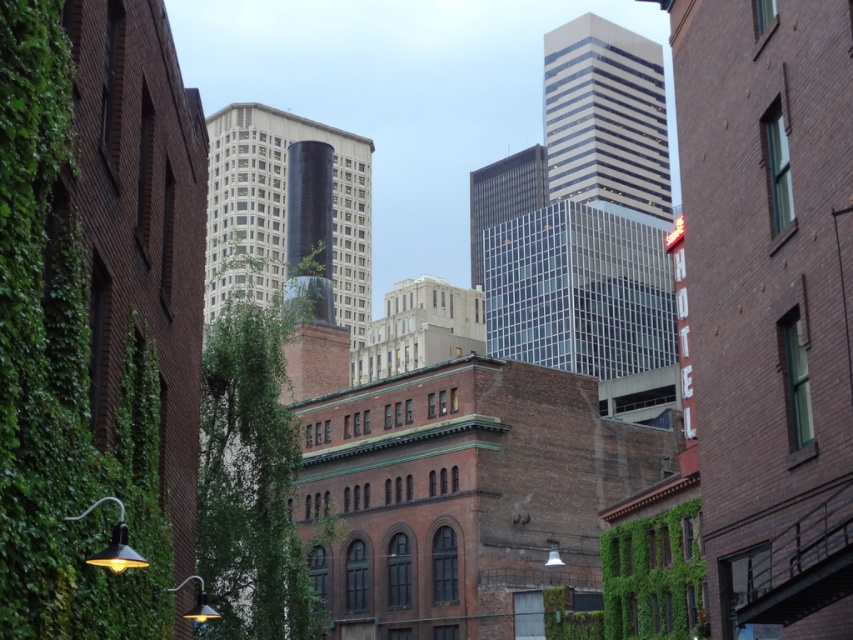
Question: Is the position of green ivy at left more distant than that of green leafy ivy at center?

Choices:
 (A) yes
 (B) no

Answer: (B)

Question: Which point is closer to the camera taking this photo?

Choices:
 (A) (36, 305)
 (B) (216, 608)

Answer: (A)

Question: Does green ivy at left come in front of green leafy ivy at center?

Choices:
 (A) no
 (B) yes

Answer: (B)

Question: Does green ivy at left appear on the right side of green leafy ivy at center?

Choices:
 (A) no
 (B) yes

Answer: (B)